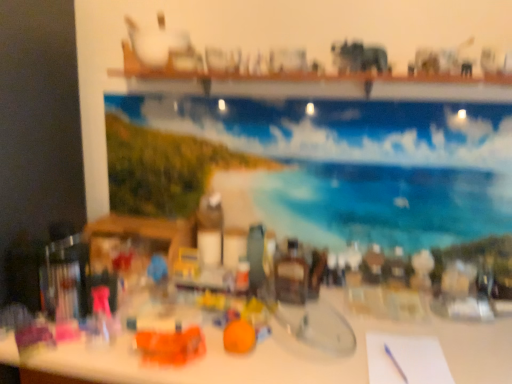
Question: Is orange plastic toy at center, placed as the first toy when sorted from left to right, taller or shorter than orange matte toy at center, which is the 2th toy from left to right?

Choices:
 (A) short
 (B) tall

Answer: (A)

Question: From the image's perspective, is orange plastic toy at center, which is the 2th toy from right to left, located above or below orange matte toy at center, which is counted as the first toy, starting from the right?

Choices:
 (A) below
 (B) above

Answer: (A)

Question: Which object is positioned farthest from the white paper at lower right?

Choices:
 (A) orange plastic toy at center, placed as the first toy when sorted from left to right
 (B) orange matte toy at center, which is counted as the first toy, starting from the right
 (C) blue glossy painting at upper center
 (D) white glossy table at center

Answer: (C)

Question: Which object is positioned closest to the orange plastic toy at center, which is the 2th toy from right to left?

Choices:
 (A) blue glossy painting at upper center
 (B) white glossy table at center
 (C) orange matte toy at center, which is the 2th toy from left to right
 (D) white paper at lower right

Answer: (C)